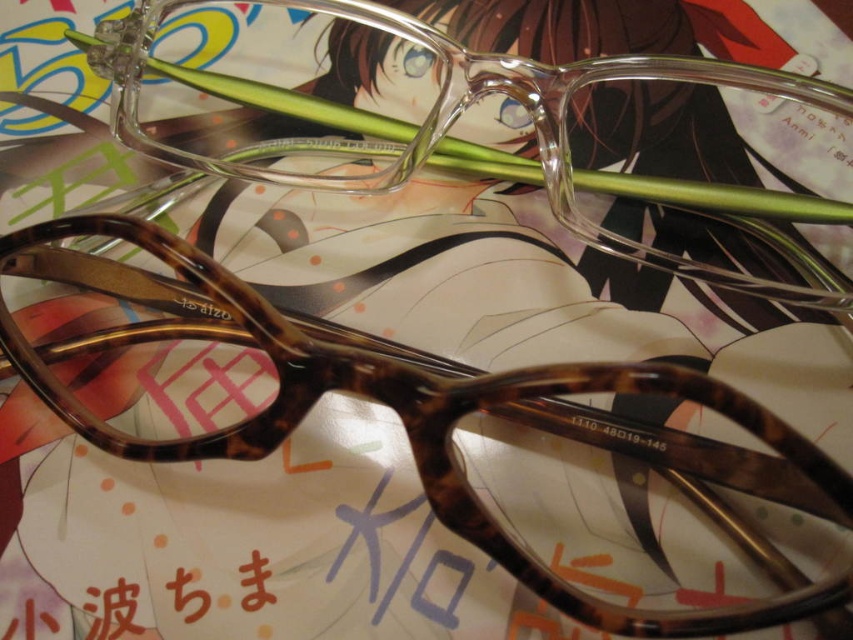
You are organizing a display of eyeglasses. You need to place the tortoiseshell acetate glasses at center and the tortoiseshell plastic glasses at center in a specific order. According to the image, which of these glasses is positioned to the left of the other?

The tortoiseshell acetate glasses at center are to the left of the tortoiseshell plastic glasses at center.

You are an optometrist examining an image of glasses on a colorful manga page. You need to locate the tortoiseshell acetate glasses at center. What are their exact coordinates in the image?

The tortoiseshell acetate glasses at center are located at coordinates point (425, 426).

You are trying to determine the order of the glasses from front to back. Which pair is closer to you, the tortoiseshell acetate glasses at center or the tortoiseshell plastic glasses at center?

The tortoiseshell acetate glasses at center is in front of the tortoiseshell plastic glasses at center, so the tortoiseshell acetate glasses at center is closer to you.